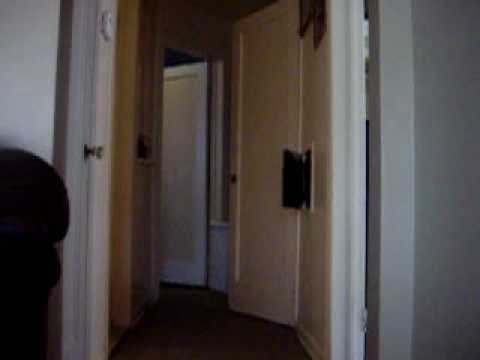
Image resolution: width=480 pixels, height=360 pixels. In order to click on door in this screenshot , I will do `click(183, 196)`.